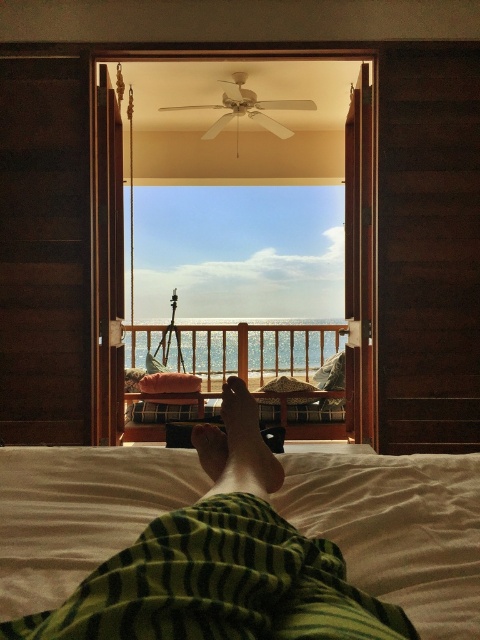
Can you confirm if transparent glass door at center is smaller than wooden bench at center?

No, transparent glass door at center is not smaller than wooden bench at center.

What do you see at coordinates (247, 227) in the screenshot? I see `transparent glass door at center` at bounding box center [247, 227].

The image size is (480, 640). I want to click on transparent glass door at center, so click(247, 227).

Between transparent glass door at center and white soft bed at lower center, which one appears on the right side from the viewer's perspective?

transparent glass door at center

Which of these two, transparent glass door at center or white soft bed at lower center, stands shorter?

white soft bed at lower center

Which is in front, point (127, 348) or point (310, 499)?

Point (310, 499) is in front.

Where is `transparent glass door at center`? The height and width of the screenshot is (640, 480). transparent glass door at center is located at coordinates (247, 227).

Between white soft bed at lower center and light brown skin at center, which one is positioned lower?

white soft bed at lower center is below.

Which is in front, point (333, 506) or point (245, 397)?

Point (333, 506)

What do you see at coordinates (396, 529) in the screenshot? I see `white soft bed at lower center` at bounding box center [396, 529].

Where is `white soft bed at lower center`? This screenshot has width=480, height=640. white soft bed at lower center is located at coordinates (396, 529).